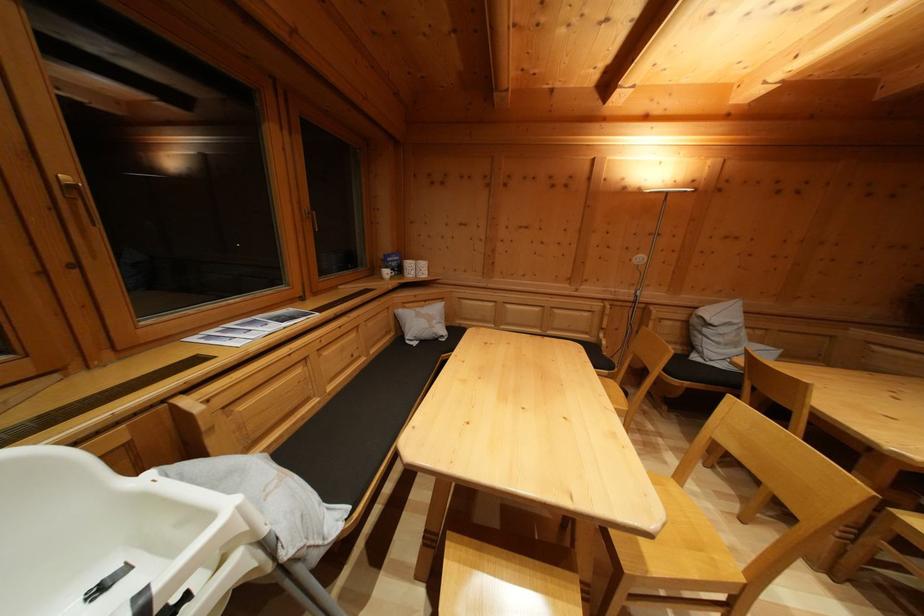
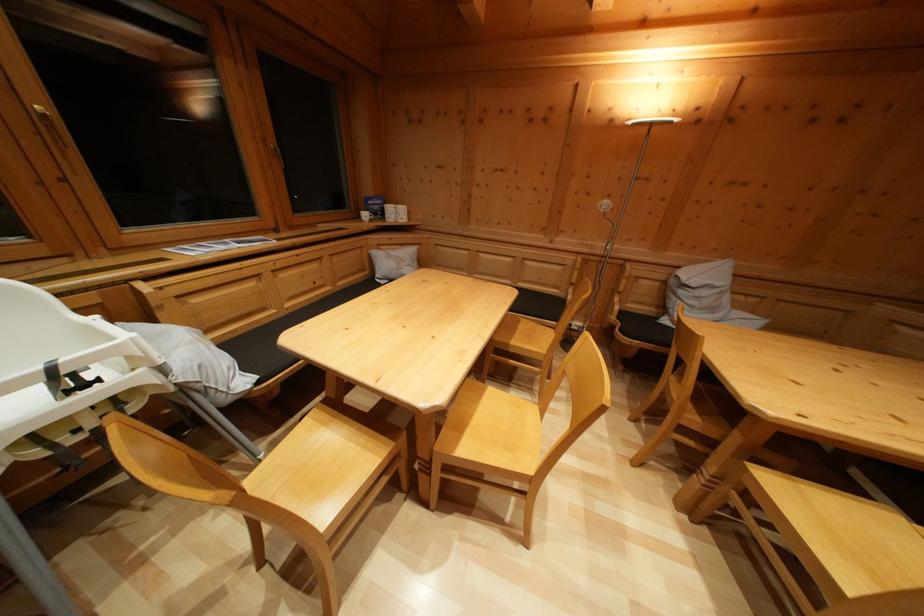
Where in the second image is the point corresponding to (324,408) from the first image?

(282, 321)